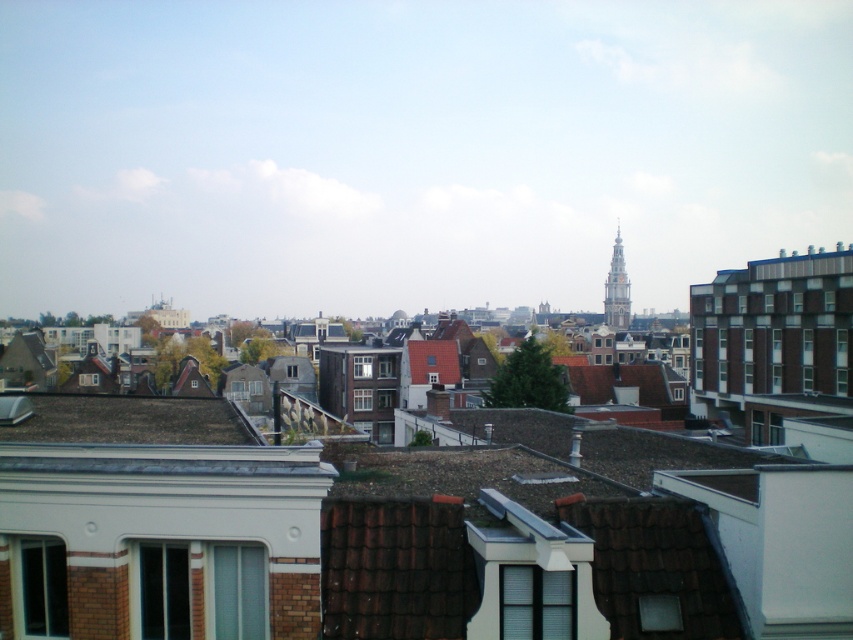
You are an architect analyzing the cityscape. You notice the brown shingles at lower left and the golden stone tower at upper right. Which of these two objects has a larger physical size in the image?

The golden stone tower at upper right has a larger physical size than the brown shingles at lower left.

You are standing in the city looking at the brown shingles at lower left and the golden stone tower at upper right. Which object would appear larger in your view?

The brown shingles at lower left would appear larger because they are closer to the viewer than the golden stone tower at upper right.

In the scene shown: You are an architect analyzing the cityscape. You need to determine the relative height of the brown shingles at lower left and the golden stone tower at upper right. Which one is taller?

The golden stone tower at upper right is taller than the brown shingles at lower left.